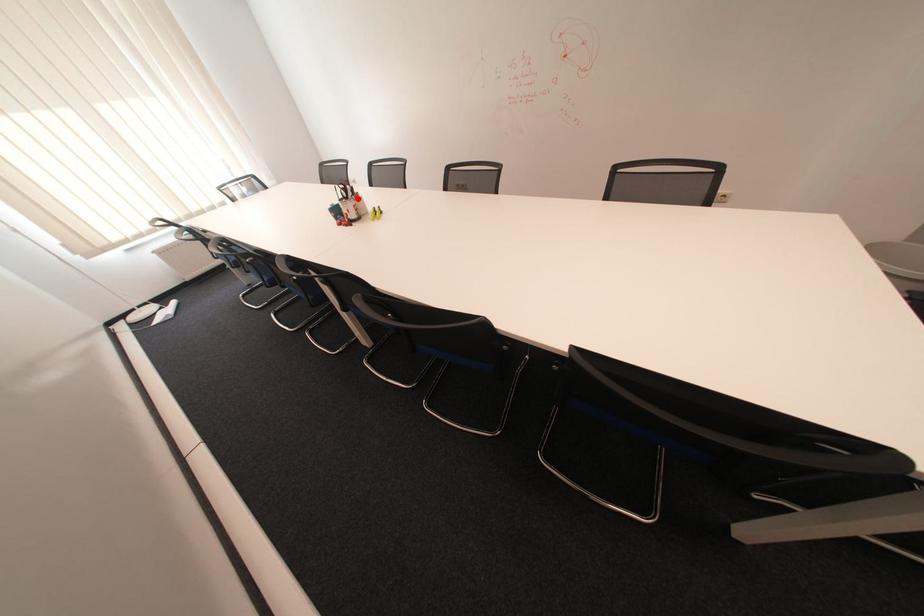
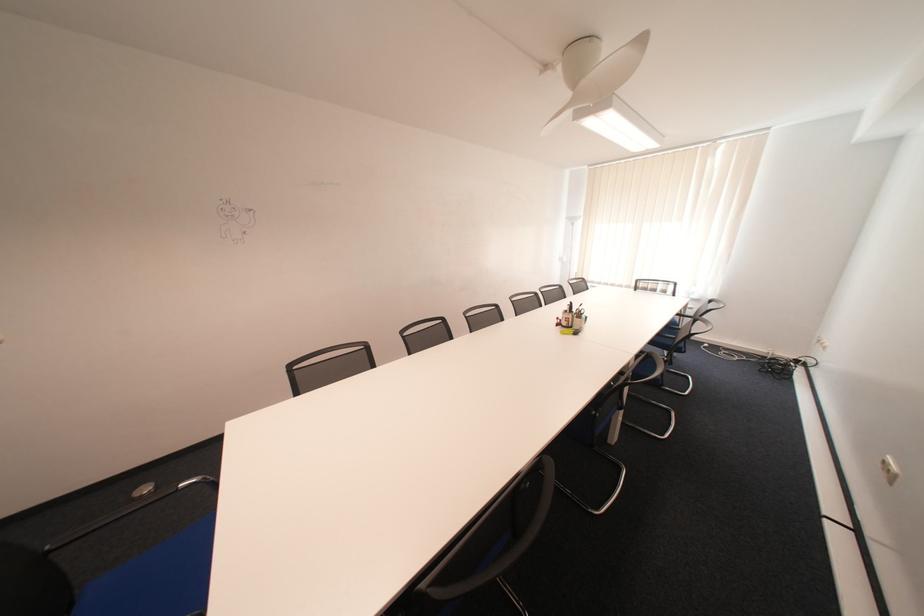
The point at the highlighted location is marked in the first image. Where is the corresponding point in the second image?

(578, 312)